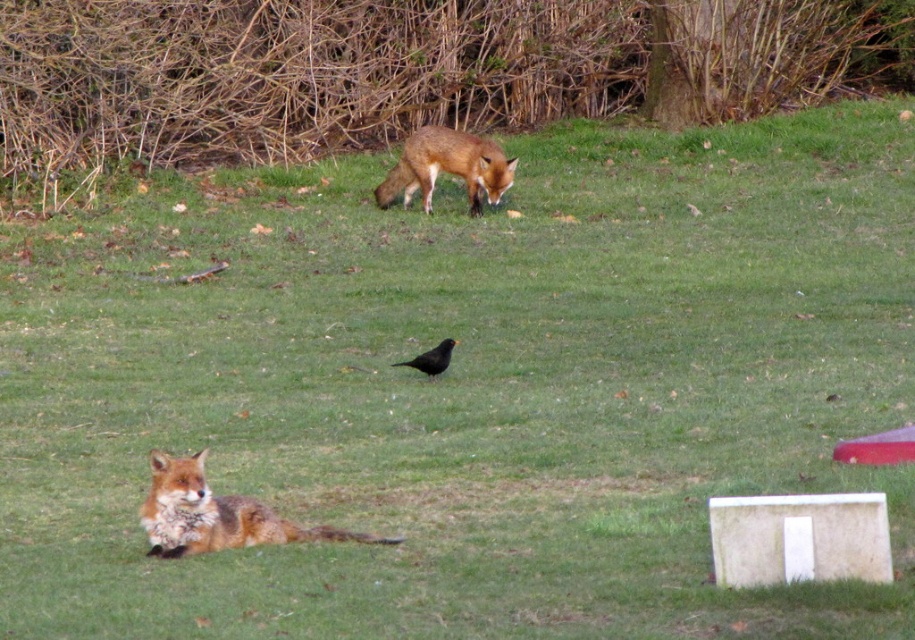
Who is lower down, orange fur fox at upper center or black matte bird at center?

black matte bird at center is below.

Who is taller, orange fur fox at upper center or black matte bird at center?

orange fur fox at upper center is taller.

This screenshot has width=915, height=640. I want to click on orange fur fox at upper center, so click(447, 168).

Is orange fur fox at lower left positioned before orange fur fox at upper center?

Yes, it is in front of orange fur fox at upper center.

Describe the element at coordinates (216, 515) in the screenshot. I see `orange fur fox at lower left` at that location.

Is point (152, 516) closer to viewer compared to point (472, 154)?

Yes, point (152, 516) is in front of point (472, 154).

Where is `orange fur fox at lower left`? orange fur fox at lower left is located at coordinates (216, 515).

Can you confirm if orange fur fox at lower left is positioned to the left of black matte bird at center?

Correct, you'll find orange fur fox at lower left to the left of black matte bird at center.

Does orange fur fox at lower left come behind black matte bird at center?

No, it is not.

At what (x,y) coordinates should I click in order to perform the action: click on orange fur fox at lower left. Please return your answer as a coordinate pair (x, y). Looking at the image, I should click on (216, 515).